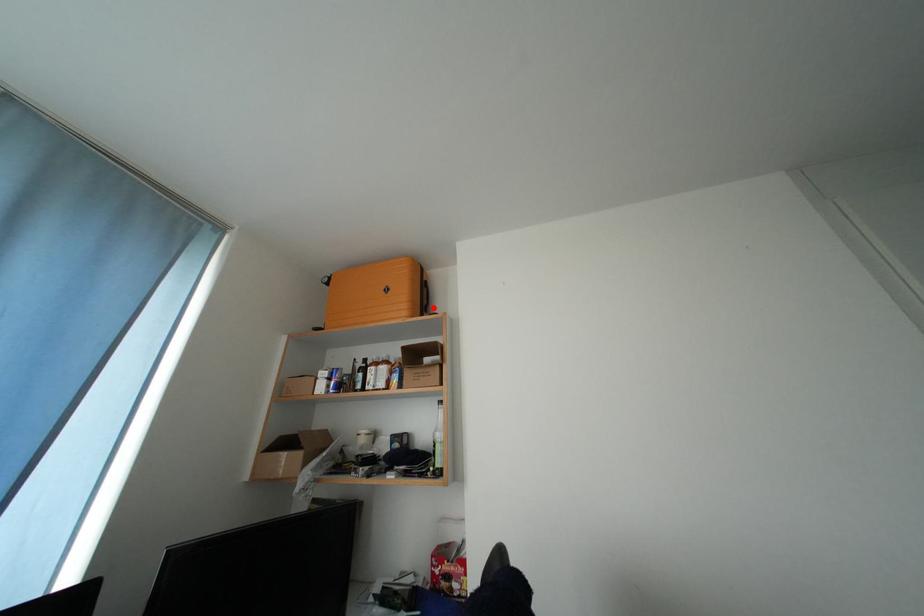
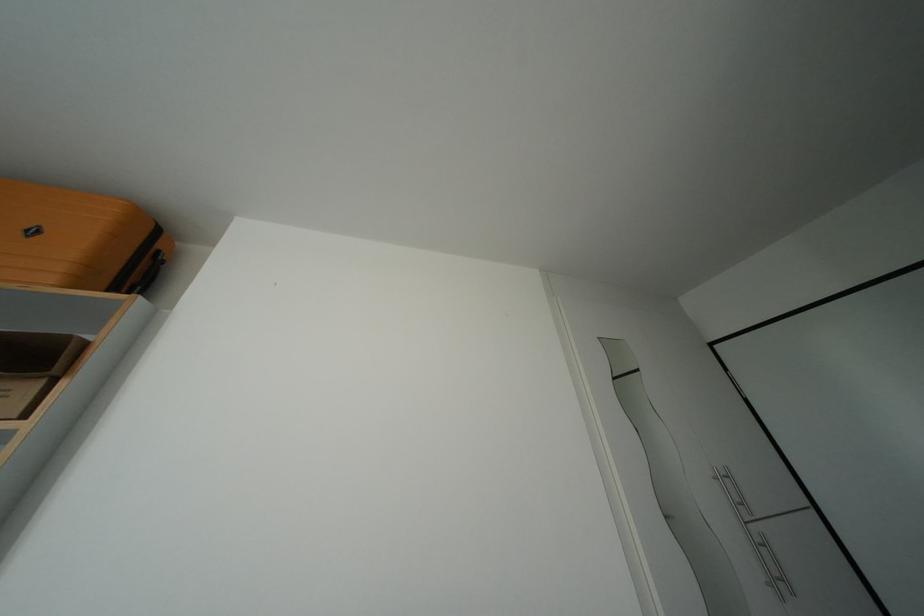
Where in the second image is the point corresponding to the highlighted location from the first image?

(141, 285)